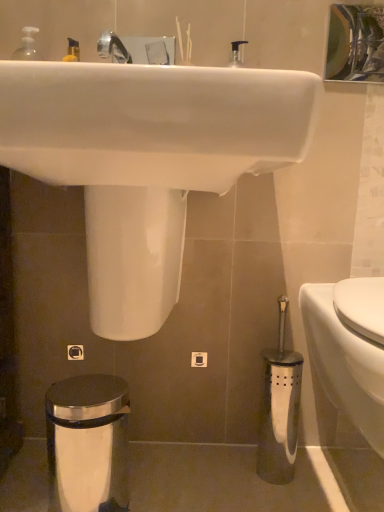
The image size is (384, 512). What do you see at coordinates (88, 443) in the screenshot? I see `satin chrome trash can at lower left` at bounding box center [88, 443].

In the scene shown: What is the approximate width of satin chrome trash can at lower left?

satin chrome trash can at lower left is 20.14 centimeters wide.

Identify the location of white glossy toilet at lower right. The image size is (384, 512). coord(344,364).

Is white glossy toilet at lower right positioned with its back to satin chrome trash can at lower left?

No, satin chrome trash can at lower left is not at the back of white glossy toilet at lower right.

Considering the positions of objects white glossy toilet at lower right and satin chrome trash can at lower left in the image provided, who is more to the right, white glossy toilet at lower right or satin chrome trash can at lower left?

white glossy toilet at lower right is more to the right.

Considering the relative sizes of white glossy toilet at lower right and satin chrome trash can at lower left in the image provided, is white glossy toilet at lower right bigger than satin chrome trash can at lower left?

Yes, white glossy toilet at lower right is bigger than satin chrome trash can at lower left.

From the image's perspective, who appears lower, white glossy toilet at lower right or satin chrome trash can at lower left?

satin chrome trash can at lower left appears lower in the image.

From the image's perspective, which is above, satin chrome trash can at lower left or white glossy toilet at lower right?

white glossy toilet at lower right appears higher in the image.

Does satin chrome trash can at lower left have a smaller size compared to white glossy toilet at lower right?

Correct, satin chrome trash can at lower left occupies less space than white glossy toilet at lower right.

Is satin chrome trash can at lower left located outside white glossy toilet at lower right?

Yes.

Is satin chrome trash can at lower left turned away from white glossy toilet at lower right?

satin chrome trash can at lower left is not turned away from white glossy toilet at lower right.

Which point is more forward, [274,383] or [220,159]?

Positioned in front is point [220,159].

Where is `brush below the white glossy sink at upper center (from a real-world perspective)`? brush below the white glossy sink at upper center (from a real-world perspective) is located at coordinates (279, 409).

Considering the sizes of objects metallic silver toilet brush at lower right and white glossy sink at upper center in the image provided, who is smaller, metallic silver toilet brush at lower right or white glossy sink at upper center?

metallic silver toilet brush at lower right is smaller.

Can you confirm if metallic silver toilet brush at lower right is shorter than white glossy sink at upper center?

Yes.

Could you measure the distance between white glossy toilet at lower right and metallic reflective mirror at upper center?

white glossy toilet at lower right is 4.31 feet away from metallic reflective mirror at upper center.

Is white glossy toilet at lower right to the left or to the right of metallic reflective mirror at upper center in the image?

From the image, it's evident that white glossy toilet at lower right is to the left of metallic reflective mirror at upper center.

Image resolution: width=384 pixels, height=512 pixels. What are the coordinates of `mirror located above the white glossy toilet at lower right (from the image's perspective)` in the screenshot? It's located at (355, 42).

Is white glossy toilet at lower right facing towards metallic reflective mirror at upper center?

No, white glossy toilet at lower right is not facing towards metallic reflective mirror at upper center.

From the image's perspective, which is below, satin chrome trash can at lower left or metallic silver toilet brush at lower right?

satin chrome trash can at lower left appears lower in the image.

Which is in front, point (101, 468) or point (274, 468)?

The point (101, 468) is in front.

Considering the relative positions of satin chrome trash can at lower left and metallic silver toilet brush at lower right in the image provided, is satin chrome trash can at lower left to the left of metallic silver toilet brush at lower right from the viewer's perspective?

Correct, you'll find satin chrome trash can at lower left to the left of metallic silver toilet brush at lower right.

Could you measure the distance between satin chrome trash can at lower left and metallic silver toilet brush at lower right?

A distance of 16.58 inches exists between satin chrome trash can at lower left and metallic silver toilet brush at lower right.

Is satin chrome trash can at lower left in front of metallic reflective mirror at upper center?

Yes, satin chrome trash can at lower left is in front of metallic reflective mirror at upper center.

From a real-world perspective, is satin chrome trash can at lower left positioned under metallic reflective mirror at upper center based on gravity?

Indeed, from a real-world perspective, satin chrome trash can at lower left is positioned beneath metallic reflective mirror at upper center.

Looking at this image, from the image's perspective, which is above, satin chrome trash can at lower left or metallic reflective mirror at upper center?

metallic reflective mirror at upper center.

Is white glossy sink at upper center spatially inside white glossy toilet at lower right, or outside of it?

white glossy sink at upper center is located beyond the bounds of white glossy toilet at lower right.

From the image's perspective, is white glossy sink at upper center beneath white glossy toilet at lower right?

No, from the image's perspective, white glossy sink at upper center is not below white glossy toilet at lower right.

Is white glossy sink at upper center turned away from white glossy toilet at lower right?

No, white glossy sink at upper center is not facing away from white glossy toilet at lower right.

Between white glossy sink at upper center and white glossy toilet at lower right, which one has smaller width?

white glossy sink at upper center.

This screenshot has height=512, width=384. What are the coordinates of `toilet above the satin chrome trash can at lower left (from the image's perspective)` in the screenshot? It's located at (344, 364).

Image resolution: width=384 pixels, height=512 pixels. What are the coordinates of `trash bin/can located underneath the white glossy toilet at lower right (from a real-world perspective)` in the screenshot? It's located at (88, 443).

From the image, which object appears to be nearer to satin chrome trash can at lower left, white glossy toilet at lower right or metallic silver toilet brush at lower right?

metallic silver toilet brush at lower right lies closer to satin chrome trash can at lower left than the other object.

When comparing their distances from white glossy toilet at lower right, does metallic reflective mirror at upper center or satin chrome trash can at lower left seem closer?

The object closer to white glossy toilet at lower right is satin chrome trash can at lower left.

Looking at the image, which one is located further to white glossy toilet at lower right, metallic silver toilet brush at lower right or satin chrome trash can at lower left?

satin chrome trash can at lower left.

From the image, which object appears to be nearer to metallic silver toilet brush at lower right, satin chrome trash can at lower left or metallic reflective mirror at upper center?

The object closer to metallic silver toilet brush at lower right is satin chrome trash can at lower left.

Looking at the image, which one is located further to white glossy sink at upper center, satin chrome trash can at lower left or metallic silver toilet brush at lower right?

metallic silver toilet brush at lower right is positioned further to the anchor white glossy sink at upper center.

Based on their spatial positions, is white glossy toilet at lower right or metallic silver toilet brush at lower right closer to white glossy sink at upper center?

white glossy toilet at lower right is closer to white glossy sink at upper center.

When comparing their distances from metallic reflective mirror at upper center, does white glossy sink at upper center or metallic silver toilet brush at lower right seem closer?

Among the two, white glossy sink at upper center is located nearer to metallic reflective mirror at upper center.

Which object lies nearer to the anchor point metallic reflective mirror at upper center, white glossy sink at upper center or satin chrome trash can at lower left?

white glossy sink at upper center.

Locate an element on the screen. This screenshot has width=384, height=512. brush situated between satin chrome trash can at lower left and white glossy toilet at lower right from left to right is located at coordinates (279, 409).

This screenshot has width=384, height=512. Identify the location of brush between metallic reflective mirror at upper center and satin chrome trash can at lower left vertically. (279, 409).

This screenshot has width=384, height=512. Identify the location of sink between metallic reflective mirror at upper center and metallic silver toilet brush at lower right vertically. (147, 160).

Locate an element on the screen. Image resolution: width=384 pixels, height=512 pixels. brush between white glossy sink at upper center and satin chrome trash can at lower left in the up-down direction is located at coordinates point(279,409).